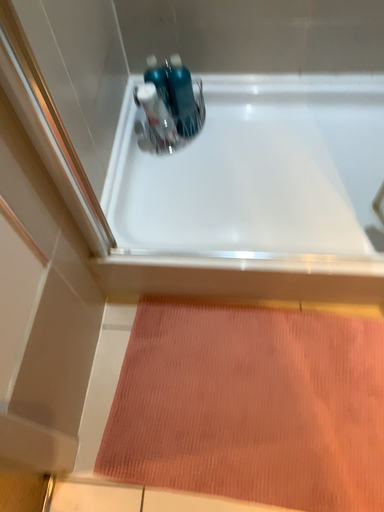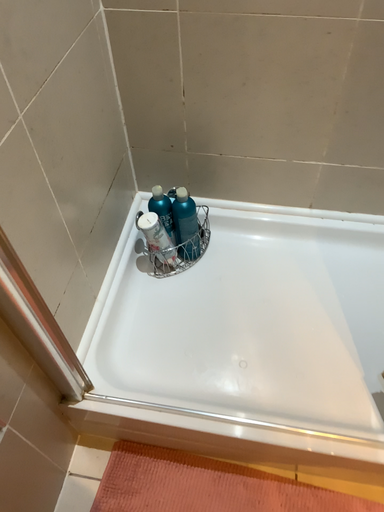
Question: How did the camera likely rotate when shooting the video?

Choices:
 (A) rotated downward
 (B) rotated upward

Answer: (B)